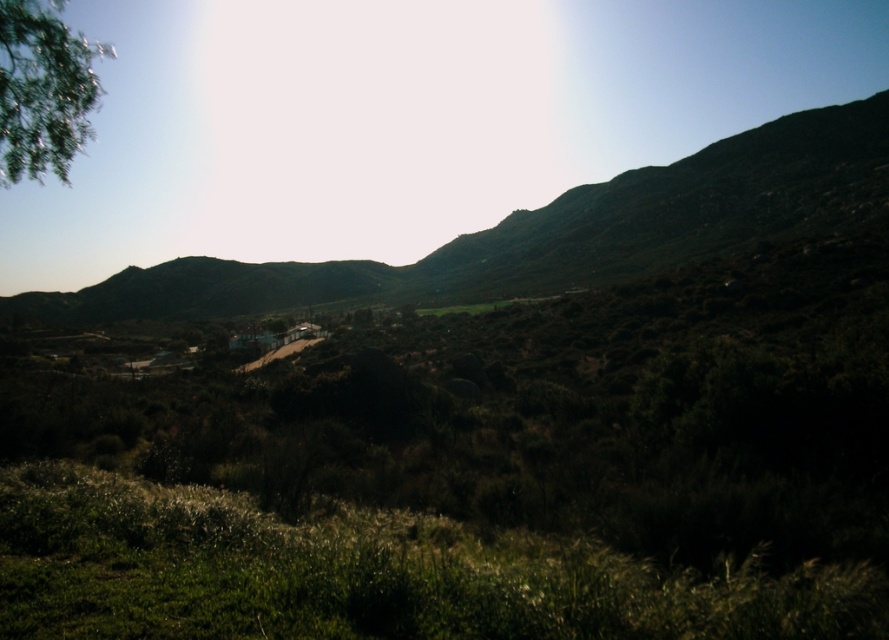
You are standing in the rural landscape and want to walk from point A to point B. Point A is located at coordinates point (x=542, y=225) and point B is at point (x=44, y=131). Since you can only move forward, will you be moving towards or away from the camera as you go from A to B?

Since point A is further to the camera than point B, moving from point A to point B would mean moving away from the camera because you are going from a point closer to the camera to one further away.

You are standing in the middle of the green grassy hill at center and want to take a photo of the green leafy tree at upper left. Which direction should you face to capture the tree in your camera?

The green grassy hill at center is located above the green leafy tree at upper left, so you should face downward to capture the tree in your camera.